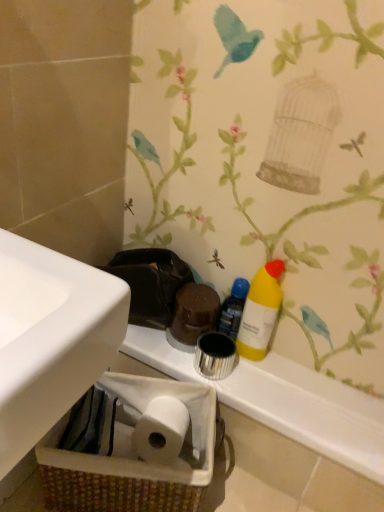
What is the approximate width of white glossy counter top at center?

white glossy counter top at center is 8.48 inches in width.

I want to click on brown woven basket at lower left, so click(x=133, y=448).

At what (x,y) coordinates should I click in order to perform the action: click on white glossy counter top at center. Please return your answer as a coordinate pair (x, y). Looking at the image, I should click on (284, 401).

From a real-world perspective, is brown woven basket at lower left positioned above or below yellow matte bottle at center right?

From a real-world perspective, brown woven basket at lower left is physically below yellow matte bottle at center right.

Is there a large distance between brown woven basket at lower left and yellow matte bottle at center right?

No, brown woven basket at lower left is in close proximity to yellow matte bottle at center right.

Is brown woven basket at lower left smaller than yellow matte bottle at center right?

Actually, brown woven basket at lower left might be larger than yellow matte bottle at center right.

Is point (134, 492) positioned behind point (252, 357)?

No, it is in front of (252, 357).

Between brown woven basket at lower left and white glossy counter top at center, which one has smaller size?

white glossy counter top at center.

Looking at their sizes, would you say brown woven basket at lower left is wider or thinner than white glossy counter top at center?

In the image, brown woven basket at lower left appears to be wider than white glossy counter top at center.

Consider the image. Relative to white glossy counter top at center, is brown woven basket at lower left in front or behind?

Visually, brown woven basket at lower left is located in front of white glossy counter top at center.

Is white glossy counter top at center not near yellow matte bottle at right?

They are positioned close to each other.

From the image's perspective, would you say white glossy counter top at center is shown under yellow matte bottle at right?

Correct, white glossy counter top at center appears lower than yellow matte bottle at right in the image.

Between white glossy counter top at center and yellow matte bottle at right, which one appears on the left side from the viewer's perspective?

Positioned to the left is yellow matte bottle at right.

Considering the sizes of white glossy counter top at center and yellow matte bottle at right in the image, is white glossy counter top at center wider or thinner than yellow matte bottle at right?

white glossy counter top at center is wider than yellow matte bottle at right.

Consider the image. Can you tell me how much white glossy counter top at center and yellow matte bottle at center right differ in facing direction?

0.596 degrees.

Which object is further away from the camera, white glossy counter top at center or yellow matte bottle at center right?

yellow matte bottle at center right is further away from the camera.

From a real-world perspective, which is physically above, white glossy counter top at center or yellow matte bottle at center right?

From a 3D spatial view, yellow matte bottle at center right is above.

Between white glossy counter top at center and yellow matte bottle at center right, which one has less height?

Standing shorter between the two is white glossy counter top at center.

Looking at this image, is yellow matte bottle at right facing towards white glossy counter top at center?

No, yellow matte bottle at right does not turn towards white glossy counter top at center.

Does yellow matte bottle at right touch white glossy counter top at center?

No, yellow matte bottle at right is not in contact with white glossy counter top at center.

From the image's perspective, who appears lower, yellow matte bottle at right or white glossy counter top at center?

white glossy counter top at center appears lower in the image.

Does point (241, 323) appear closer or farther from the camera than point (314, 423)?

Point (241, 323) is farther from the camera than point (314, 423).

Would you say yellow matte bottle at center right is a long distance from white glossy counter top at center?

yellow matte bottle at center right is near white glossy counter top at center, not far away.

From a real-world perspective, who is located lower, yellow matte bottle at center right or white glossy counter top at center?

white glossy counter top at center.

Is brown woven basket at lower left in front of yellow matte bottle at right?

Yes, it is.

From a real-world perspective, is brown woven basket at lower left on top of yellow matte bottle at right?

Actually, brown woven basket at lower left is physically below yellow matte bottle at right in the real world.

Is brown woven basket at lower left directly adjacent to yellow matte bottle at right?

No, brown woven basket at lower left is not making contact with yellow matte bottle at right.

Is brown woven basket at lower left looking in the opposite direction of yellow matte bottle at right?

No.

Find the location of a particular element. This screenshot has width=384, height=512. basket container that appears below the yellow matte bottle at center right (from the image's perspective) is located at coordinates (133, 448).

At what (x,y) coordinates should I click in order to perform the action: click on basket container on the left of white glossy counter top at center. Please return your answer as a coordinate pair (x, y). Image resolution: width=384 pixels, height=512 pixels. Looking at the image, I should click on (133, 448).

Which object lies nearer to the anchor point brown woven basket at lower left, white glossy counter top at center or yellow matte bottle at center right?

white glossy counter top at center lies closer to brown woven basket at lower left than the other object.

Based on their spatial positions, is yellow matte bottle at right or yellow matte bottle at center right further from white glossy counter top at center?

yellow matte bottle at right lies further to white glossy counter top at center than the other object.

Considering their positions, is brown woven basket at lower left positioned further to white glossy counter top at center than yellow matte bottle at center right?

Among the two, brown woven basket at lower left is located further to white glossy counter top at center.

Which object lies nearer to the anchor point white glossy counter top at center, yellow matte bottle at right or brown woven basket at lower left?

brown woven basket at lower left.

When comparing their distances from brown woven basket at lower left, does white glossy counter top at center or yellow matte bottle at right seem further?

yellow matte bottle at right is further to brown woven basket at lower left.

Estimate the real-world distances between objects in this image. Which object is closer to brown woven basket at lower left, yellow matte bottle at right or yellow matte bottle at center right?

Based on the image, yellow matte bottle at center right appears to be nearer to brown woven basket at lower left.

Estimate the real-world distances between objects in this image. Which object is further from yellow matte bottle at center right, brown woven basket at lower left or yellow matte bottle at right?

brown woven basket at lower left lies further to yellow matte bottle at center right than the other object.

Estimate the real-world distances between objects in this image. Which object is closer to yellow matte bottle at center right, yellow matte bottle at right or brown woven basket at lower left?

Among the two, yellow matte bottle at right is located nearer to yellow matte bottle at center right.

Locate an element on the screen. This screenshot has height=512, width=384. bottle between brown woven basket at lower left and white glossy counter top at center is located at coordinates (233, 308).

In order to click on counter top located between brown woven basket at lower left and yellow matte bottle at center right in the left-right direction in this screenshot , I will do `click(284, 401)`.

This screenshot has width=384, height=512. What are the coordinates of `bottle between yellow matte bottle at center right and brown woven basket at lower left in the up-down direction` in the screenshot? It's located at (233, 308).

You are a GUI agent. You are given a task and a screenshot of the screen. Output one action in this format:
    pyautogui.click(x=<x>, y=<y>)
    Task: Click on the bottle that lies between yellow matte bottle at center right and white glossy counter top at center from top to bottom
    
    Given the screenshot: What is the action you would take?
    pyautogui.click(x=233, y=308)